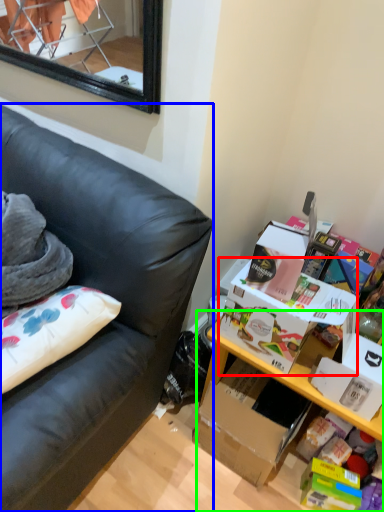
Question: Which object is positioned farthest from storage box (highlighted by a red box)? Select from studio couch (highlighted by a blue box) and table (highlighted by a green box).

Choices:
 (A) studio couch
 (B) table

Answer: (A)